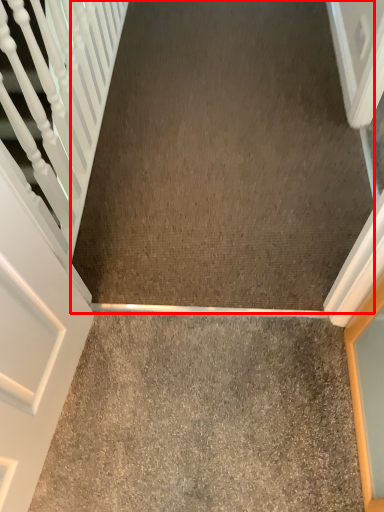
Question: Considering the relative positions of concrete (annotated by the red box) and concrete in the image provided, where is concrete (annotated by the red box) located with respect to the staircase?

Choices:
 (A) right
 (B) left

Answer: (A)